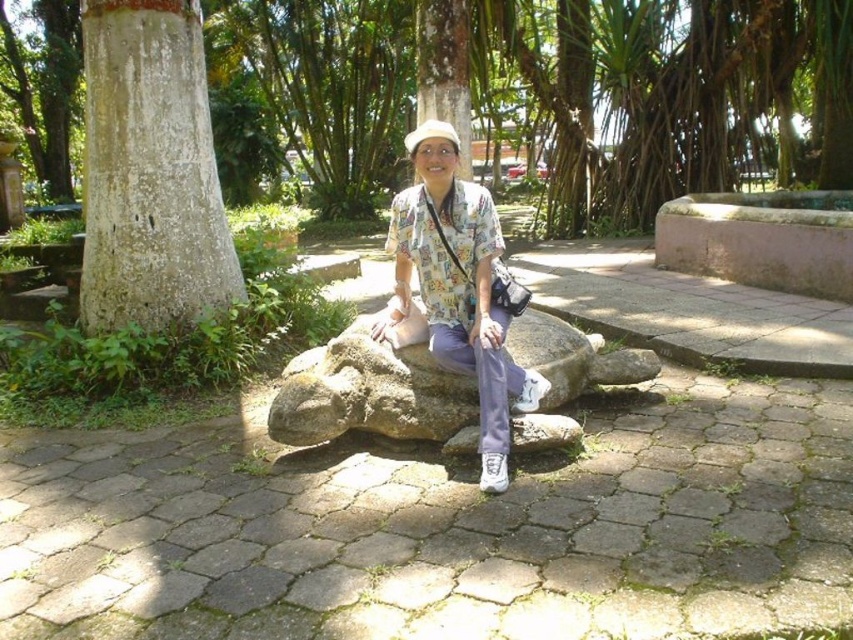
You are standing at point (439, 348) and want to walk to point (109, 237). Which direction should you face to move towards your destination?

You should face north because point (109, 237) is behind point (439, 348), meaning it is in the northern direction from your current position.

You are a photographer planning to take a picture of the rough bark tree at center and the white fabric hat at center. Which object should you focus on first if you want to capture both in a single frame without moving the camera?

You should focus on the rough bark tree at center first because it is larger than the white fabric hat at center, making it more prominent in the composition.